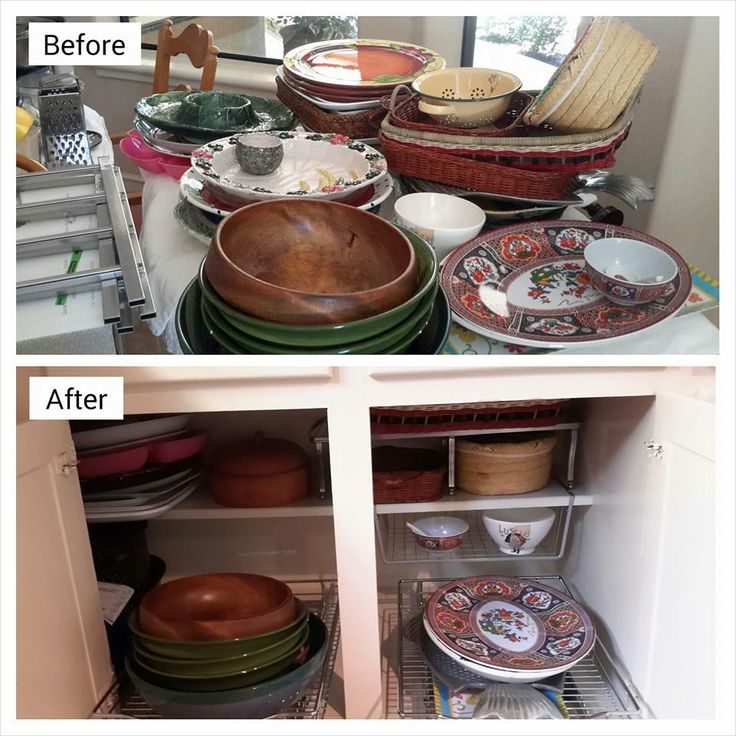
Locate an element on the screen. The image size is (736, 736). windows is located at coordinates (517, 35), (276, 21).